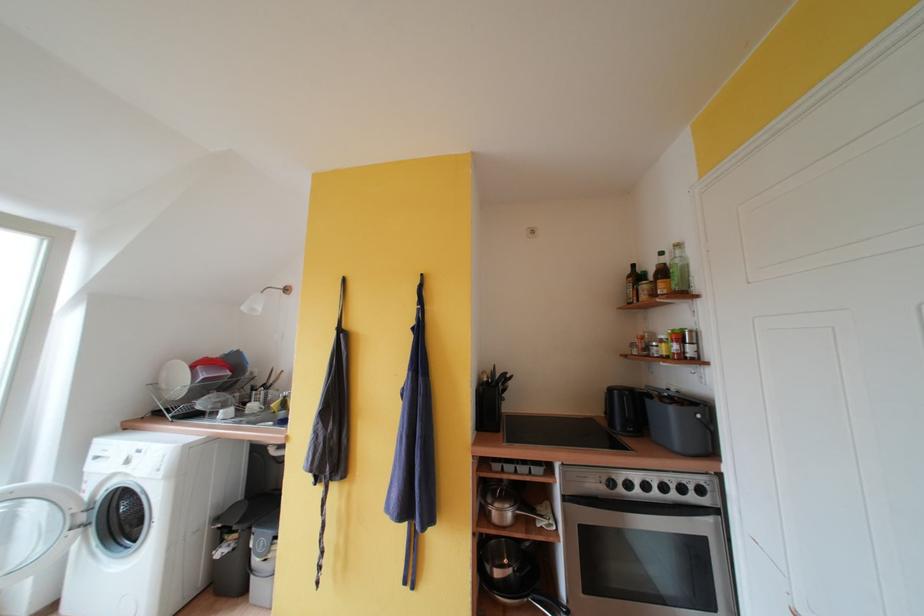
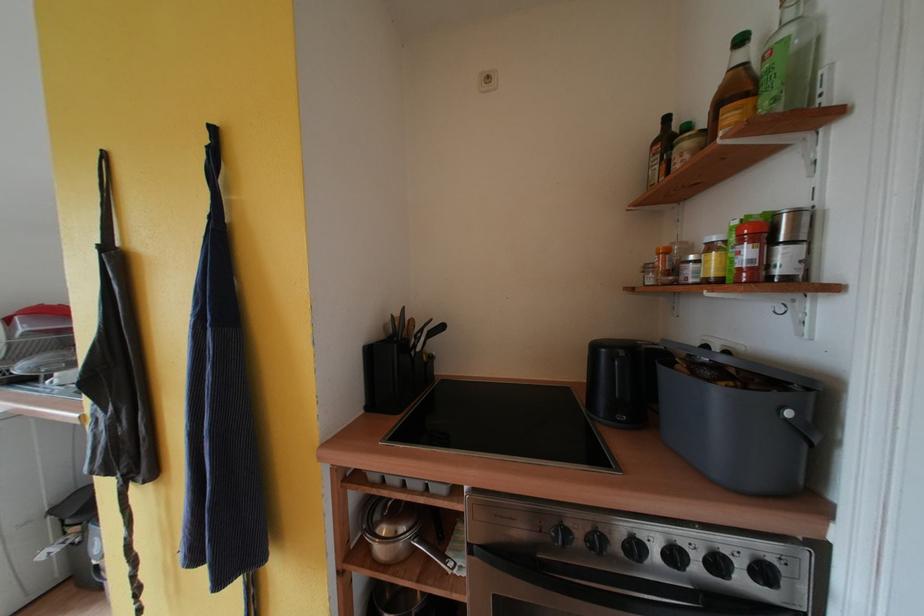
Find the pixel in the second image that matches (x=247, y=525) in the first image.

(83, 517)